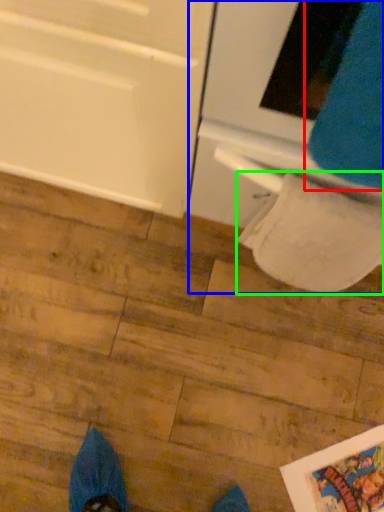
Question: Which object is the farthest from sweat pant (highlighted by a red box)? Choose among these: oven (highlighted by a blue box) or toilet paper (highlighted by a green box).

Choices:
 (A) oven
 (B) toilet paper

Answer: (B)